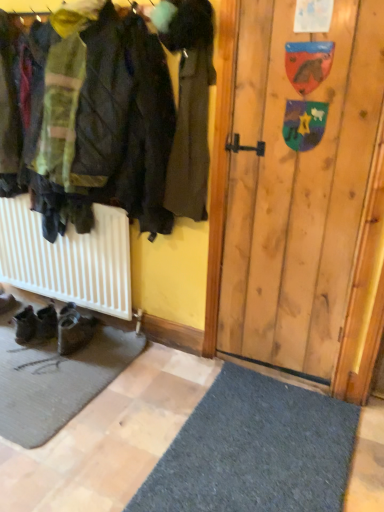
Question: From the image's perspective, relative to dark brown leather coat at center, is black leather shoes at lower left, the 2th footwear from the left, above or below?

Choices:
 (A) above
 (B) below

Answer: (B)

Question: In the image, is black leather shoes at lower left, which appears as the 1th footwear when viewed from the right, on the left side or the right side of dark brown leather coat at center?

Choices:
 (A) left
 (B) right

Answer: (A)

Question: Considering the real-world distances, which object is closest to the dark brown leather coat at center?

Choices:
 (A) black leather shoes at lower left, the 2th footwear from the left
 (B) brown suede boots at lower left, the second footwear in the right-to-left sequence

Answer: (A)

Question: Estimate the real-world distances between objects in this image. Which object is closer to the brown suede boots at lower left, the first footwear when ordered from left to right?

Choices:
 (A) black leather shoes at lower left, the 2th footwear from the left
 (B) dark brown leather coat at center

Answer: (A)